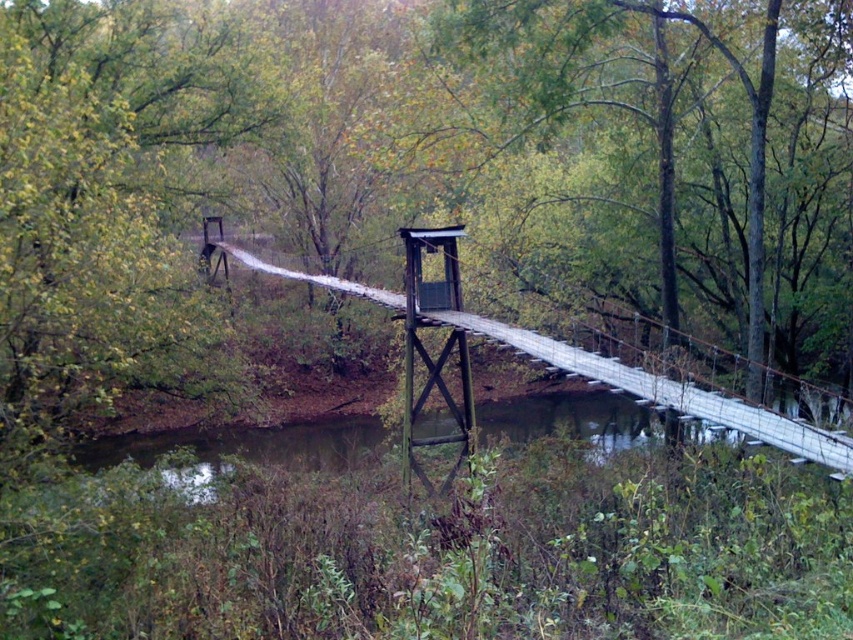
Between green leafy tree at center and wooden suspension bridge at center, which one has more height?

wooden suspension bridge at center

Based on the photo, can you confirm if green leafy tree at center is taller than wooden suspension bridge at center?

No, green leafy tree at center is not taller than wooden suspension bridge at center.

Image resolution: width=853 pixels, height=640 pixels. I want to click on green leafy tree at center, so click(x=676, y=157).